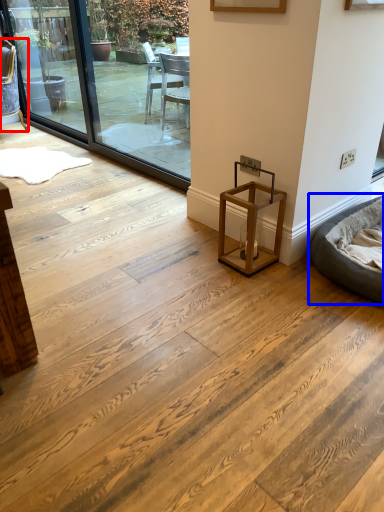
Question: Which point is further to the camera, chair (highlighted by a red box) or bean bag chair (highlighted by a blue box)?

Choices:
 (A) chair
 (B) bean bag chair

Answer: (A)